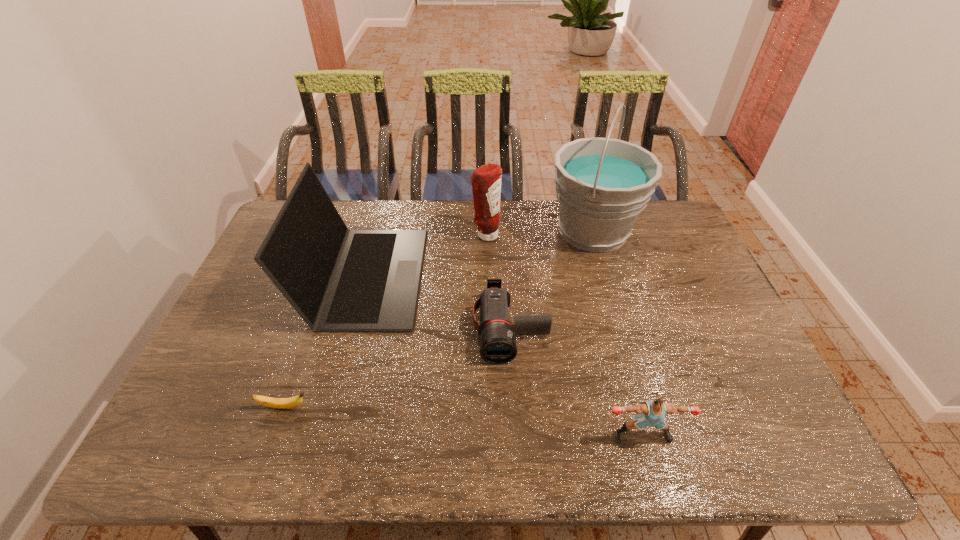
The width and height of the screenshot is (960, 540). I want to click on blank area located on the front of the condiment, so click(487, 275).

The width and height of the screenshot is (960, 540). I want to click on blank space located on the lens of the camcorder, so click(517, 447).

Where is `free space located at the stem of the banana`? The height and width of the screenshot is (540, 960). free space located at the stem of the banana is located at coordinates (461, 407).

Locate an element on the screen. bucket located in the far edge section of the desktop is located at coordinates pos(602,184).

Locate an element on the screen. laptop at the far edge is located at coordinates (337, 279).

The height and width of the screenshot is (540, 960). Find the location of `condiment present at the far edge`. condiment present at the far edge is located at coordinates (486, 180).

Where is `object at the near edge`? object at the near edge is located at coordinates (652, 413).

You are a GUI agent. You are given a task and a screenshot of the screen. Output one action in this format:
    pyautogui.click(x=<x>, y=<y>)
    Task: Click on the object located at the right edge
    
    Given the screenshot: What is the action you would take?
    pyautogui.click(x=602, y=184)

Identify the location of object present at the far right corner. (602, 184).

In order to click on free region at the far edge of the desktop in this screenshot , I will do `click(529, 200)`.